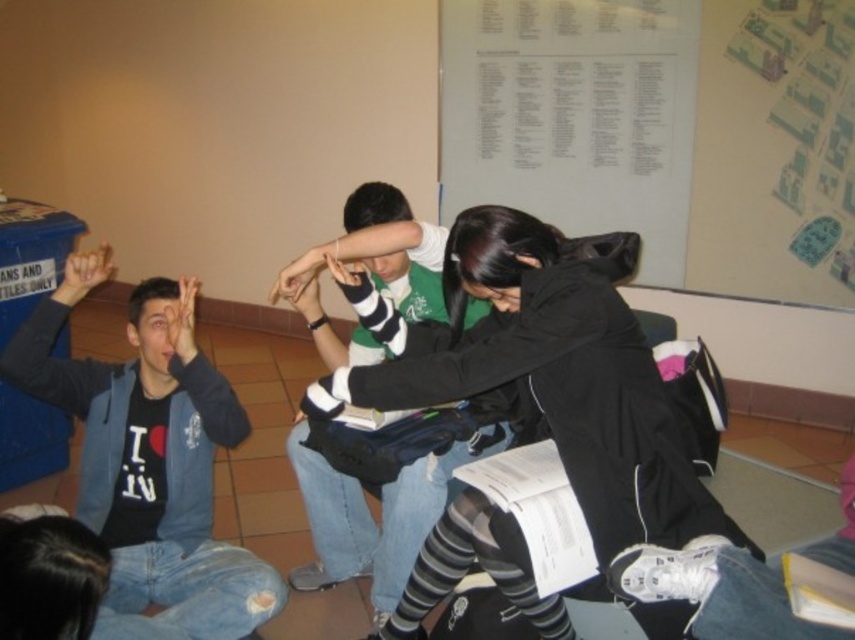
Question: From the image, what is the correct spatial relationship of green jersey at center in relation to matte black hand at upper left?

Choices:
 (A) right
 (B) left

Answer: (A)

Question: Which point is farther from the camera taking this photo?

Choices:
 (A) (101, 364)
 (B) (422, 294)
 (C) (195, 292)
 (D) (494, 269)

Answer: (C)

Question: Which object is the closest to the matte black hand at upper left?

Choices:
 (A) matte blue hoodie at left
 (B) white paper at upper center
 (C) green jersey at center

Answer: (A)

Question: Can you confirm if white paper at upper center is positioned above matte black hand at upper left?

Choices:
 (A) no
 (B) yes

Answer: (B)

Question: Which is farther from the matte black hand at upper left?

Choices:
 (A) white paper at upper center
 (B) matte blue hoodie at left
 (C) green jersey at center

Answer: (A)

Question: Does black matte jacket at center have a larger size compared to matte blue hoodie at left?

Choices:
 (A) no
 (B) yes

Answer: (B)